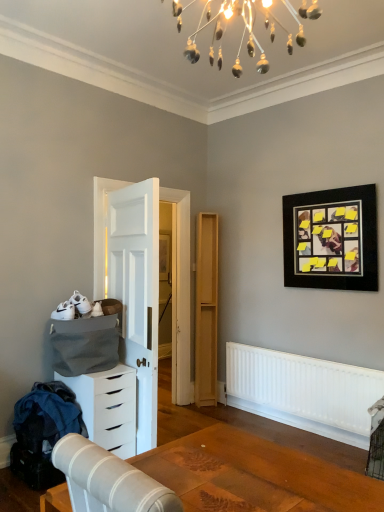
Question: Choose the correct answer: Is white wooden door at center inside denim fabric at lower left or outside it?

Choices:
 (A) outside
 (B) inside

Answer: (A)

Question: Is white wooden door at center in front of or behind denim fabric at lower left in the image?

Choices:
 (A) behind
 (B) front

Answer: (A)

Question: Estimate the real-world distances between objects in this image. Which object is closer to the light wood/file cabinet at center?

Choices:
 (A) denim fabric at lower left
 (B) white wooden door at center
 (C) white matte radiator at lower right
 (D) wooden table at lower center
 (E) black matte picture frame at upper right

Answer: (C)

Question: Which object is the farthest from the white matte radiator at lower right?

Choices:
 (A) white matte chest of drawers at lower left
 (B) wooden table at lower center
 (C) light wood/file cabinet at center
 (D) white wooden door at center
 (E) denim fabric at lower left

Answer: (B)